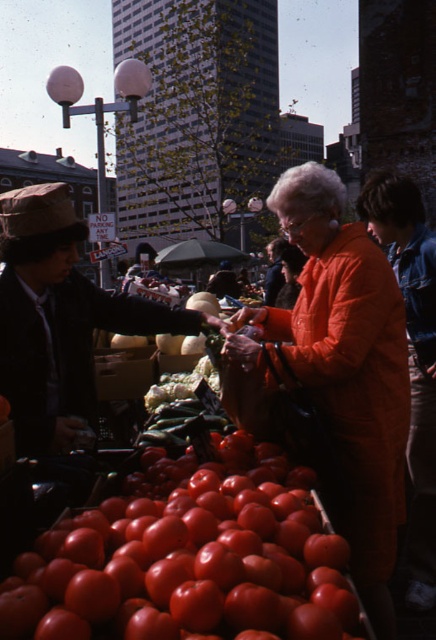
You are a customer at the market and want to know which seller is taller. You see the orange fabric jacket at center and the matte black jacket at left. Which seller is taller?

The orange fabric jacket at center is taller than the matte black jacket at left.